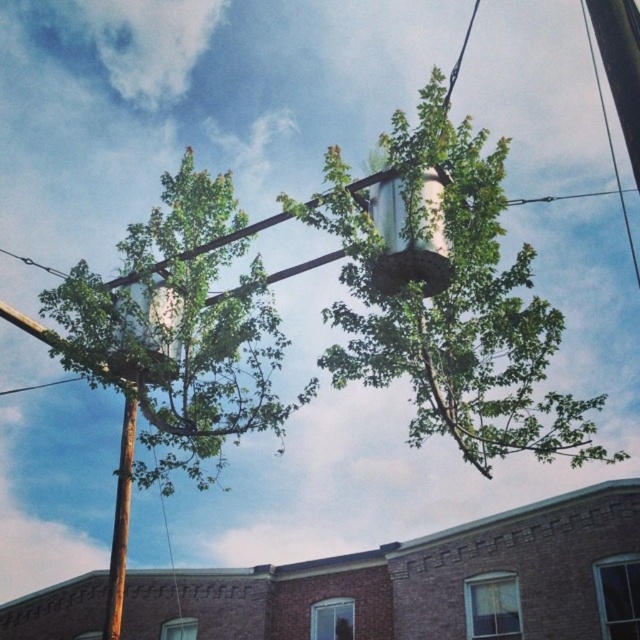
Question: Which object is the farthest from the green leafy tree at upper left?

Choices:
 (A) green leafy tree at center
 (B) brown wooden telegraph pole at left

Answer: (A)

Question: Among these objects, which one is farthest from the camera?

Choices:
 (A) brown wooden telegraph pole at left
 (B) green leafy tree at upper left
 (C) green leafy tree at center

Answer: (A)

Question: Is green leafy tree at center to the right of brown wooden telegraph pole at left from the viewer's perspective?

Choices:
 (A) no
 (B) yes

Answer: (B)

Question: Is green leafy tree at center in front of brown wooden telegraph pole at left?

Choices:
 (A) no
 (B) yes

Answer: (B)

Question: In this image, where is green leafy tree at center located relative to green leafy tree at upper left?

Choices:
 (A) right
 (B) left

Answer: (A)

Question: Which of the following is the closest to the observer?

Choices:
 (A) green leafy tree at center
 (B) green leafy tree at upper left
 (C) brown wooden telegraph pole at left

Answer: (A)